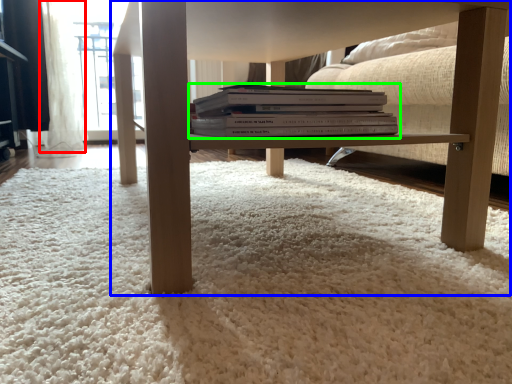
Question: Which is nearer to the curtain (highlighted by a red box)? table (highlighted by a blue box) or book (highlighted by a green box).

Choices:
 (A) table
 (B) book

Answer: (A)